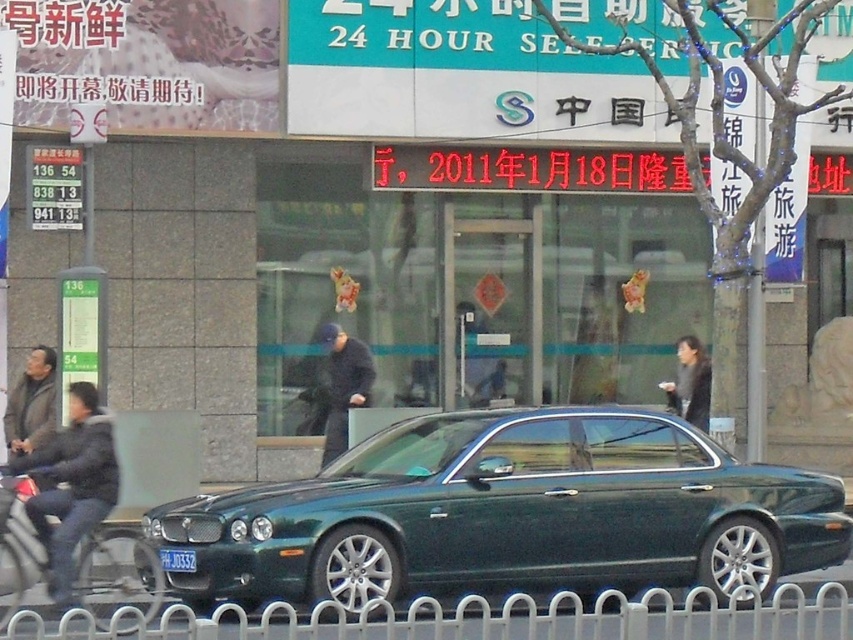
Question: Can you confirm if metallic green car at center is positioned above black matte jacket at center?

Choices:
 (A) no
 (B) yes

Answer: (A)

Question: Which of these objects is positioned farthest from the dark gray jacket at left?

Choices:
 (A) white metal fence at lower center
 (B) green metallic license plate at center
 (C) black matte jacket at center

Answer: (C)

Question: Which object is the closest to the black matte jacket at center?

Choices:
 (A) dark gray jacket at left
 (B) metallic silver bicycle at lower left

Answer: (B)

Question: Does dark gray jacket at left have a larger size compared to metallic silver bicycle at lower left?

Choices:
 (A) no
 (B) yes

Answer: (A)

Question: Among these objects, which one is nearest to the camera?

Choices:
 (A) white metal fence at lower center
 (B) green metallic license plate at center

Answer: (A)

Question: Is metallic green car at center to the right of metallic silver bicycle at lower left from the viewer's perspective?

Choices:
 (A) no
 (B) yes

Answer: (B)